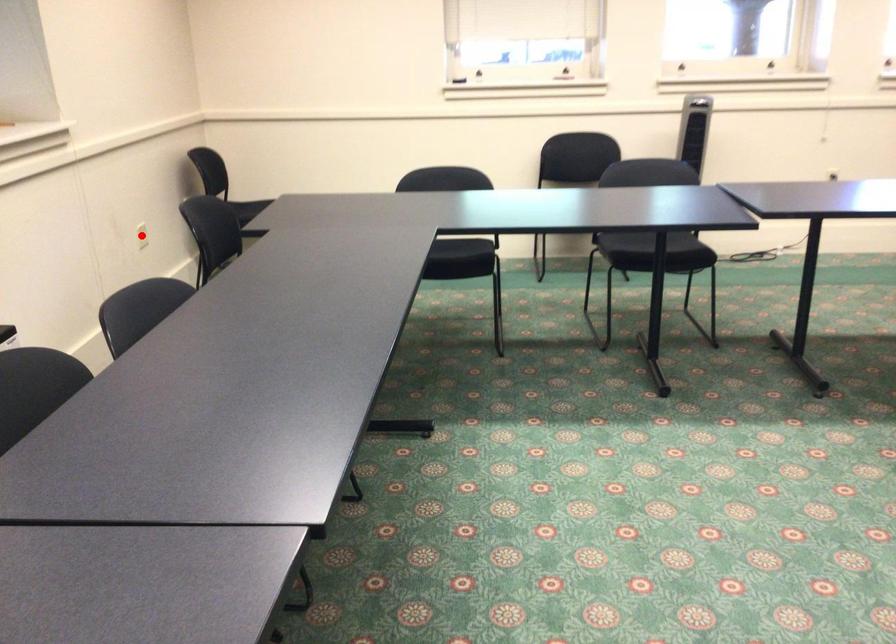
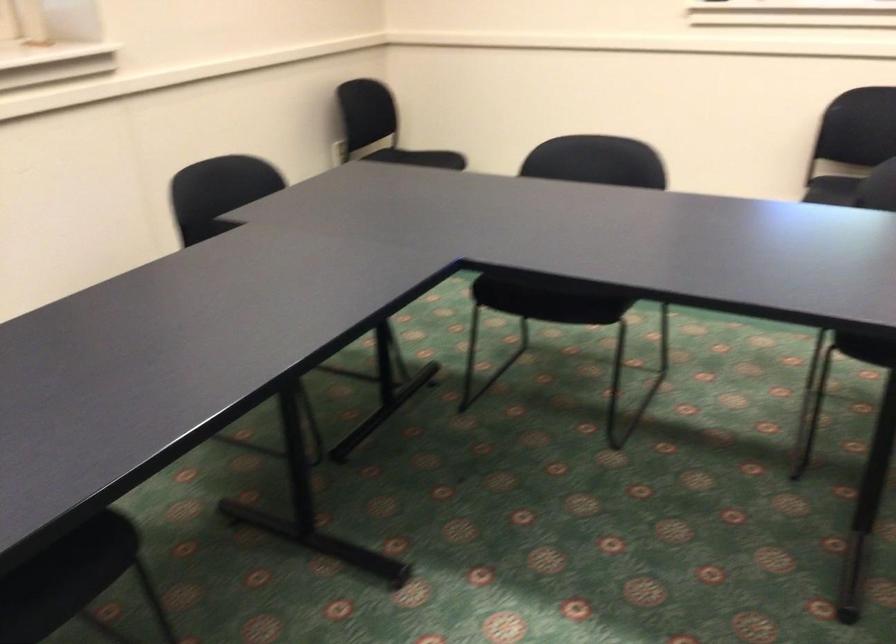
Question: I am providing you with two images of the same scene from different viewpoints. A red point is marked on the first image. Can you still see the location of the red point in image 2?

Choices:
 (A) Yes
 (B) No

Answer: (B)